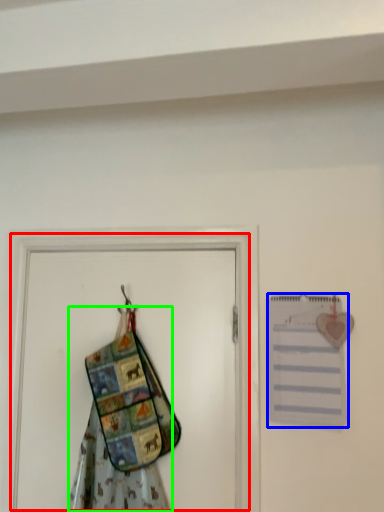
Question: Based on their relative distances, which object is farther from screen door (highlighted by a red box)? Choose from journal (highlighted by a blue box) and fancy dress (highlighted by a green box).

Choices:
 (A) journal
 (B) fancy dress

Answer: (B)